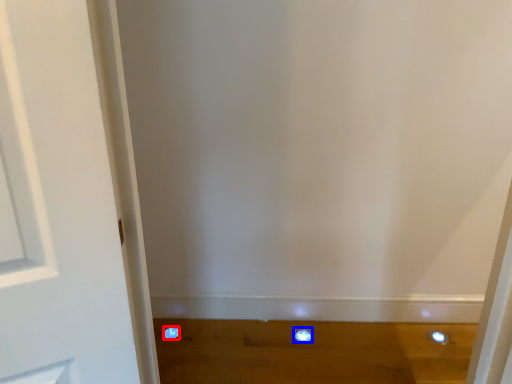
Question: Which of the following is the closest to the observer, dot (highlighted by a red box) or dot (highlighted by a blue box)?

Choices:
 (A) dot
 (B) dot

Answer: (B)